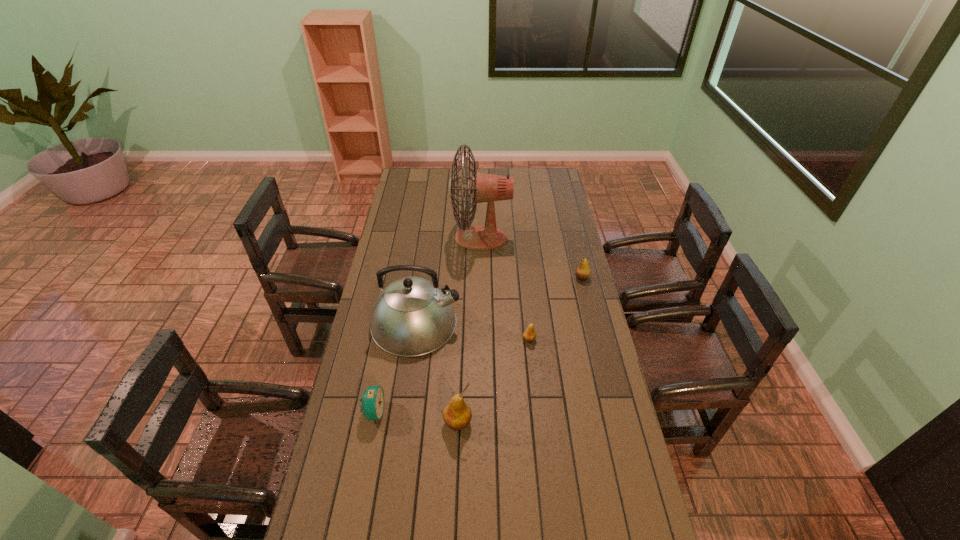
This screenshot has height=540, width=960. I want to click on free space between the fifth shortest object and the alarm clock, so click(395, 367).

You are a GUI agent. You are given a task and a screenshot of the screen. Output one action in this format:
    pyautogui.click(x=<x>, y=<y>)
    Task: Click on the blank region between the fan and the kettle
    
    Given the screenshot: What is the action you would take?
    pyautogui.click(x=448, y=280)

Find the location of a particular element. The image size is (960, 540). vacant point located between the alarm clock and the second nearest pear is located at coordinates (451, 376).

This screenshot has height=540, width=960. What are the coordinates of `free spot between the kettle and the nearest pear` in the screenshot? It's located at (437, 373).

Image resolution: width=960 pixels, height=540 pixels. In order to click on vacant area between the alarm clock and the second tallest pear in this screenshot , I will do `click(478, 345)`.

Find the location of a particular element. This screenshot has height=540, width=960. free space between the fan and the second tallest pear is located at coordinates (531, 258).

At what (x,y) coordinates should I click in order to perform the action: click on object that stands as the fifth closest to the second tallest object. Please return your answer as a coordinate pair (x, y). This screenshot has height=540, width=960. Looking at the image, I should click on (583, 271).

Find the location of a particular element. The height and width of the screenshot is (540, 960). object that ranks as the second closest to the second farthest object is located at coordinates [529, 335].

Select which pear appears as the second closest to the farthest object. Please provide its 2D coordinates. Your answer should be formatted as a tuple, i.e. [(x, y)], where the tuple contains the x and y coordinates of a point satisfying the conditions above.

[(529, 335)]

Where is `pear that stands as the closest to the leftmost pear`? pear that stands as the closest to the leftmost pear is located at coordinates (529, 335).